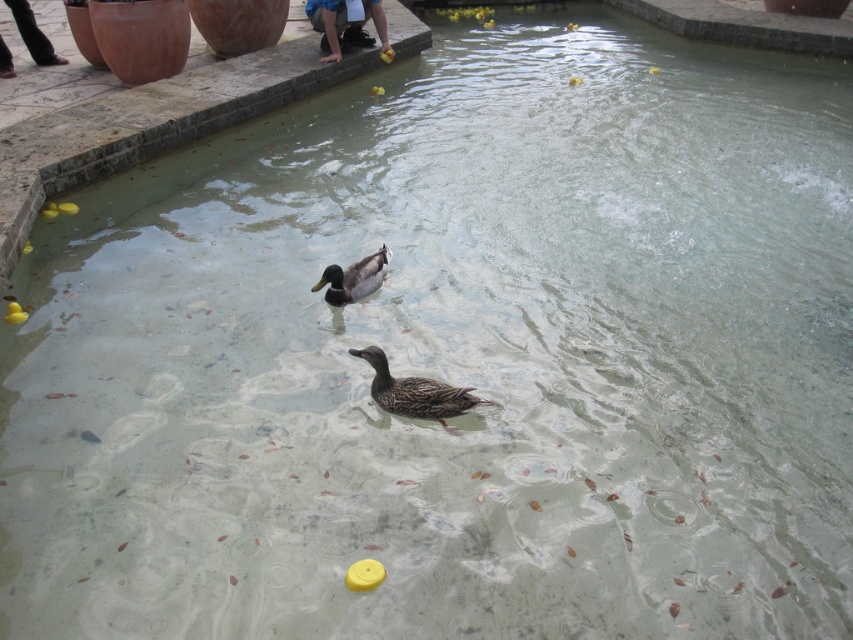
Question: Can you confirm if brown matte duck at center is positioned to the right of shiny brown duck at center?

Choices:
 (A) yes
 (B) no

Answer: (A)

Question: Which point is closer to the camera?

Choices:
 (A) brown matte duck at center
 (B) shiny brown duck at center

Answer: (A)

Question: Is brown matte duck at center bigger than shiny brown duck at center?

Choices:
 (A) no
 (B) yes

Answer: (A)

Question: In this image, where is brown matte duck at center located relative to shiny brown duck at center?

Choices:
 (A) above
 (B) below

Answer: (B)

Question: Among these objects, which one is nearest to the camera?

Choices:
 (A) brown matte duck at center
 (B) shiny brown duck at center

Answer: (A)